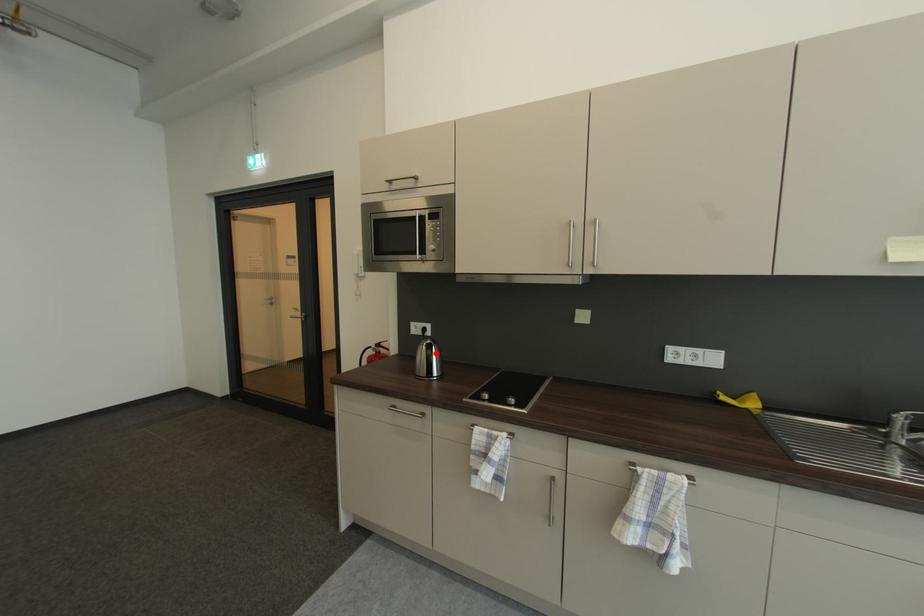
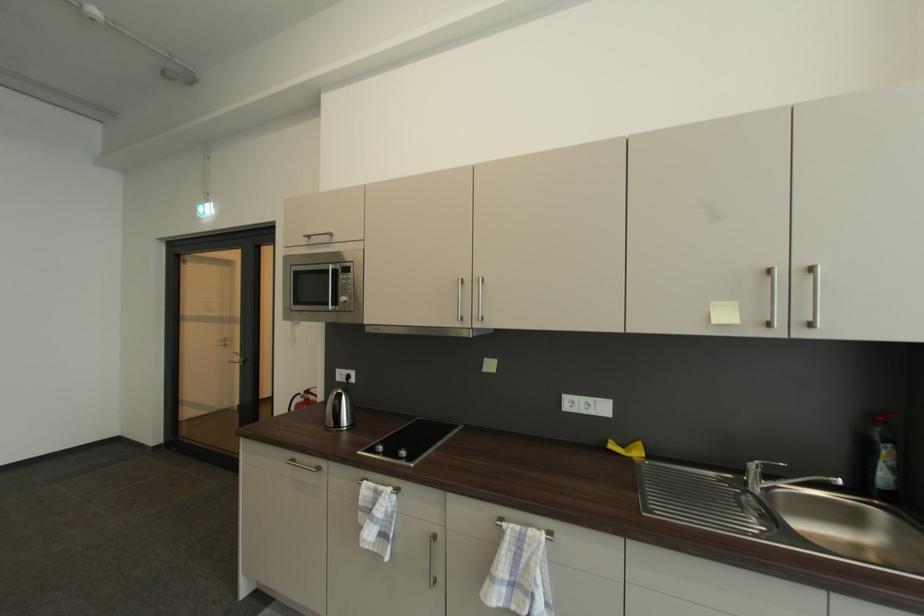
Question: I am providing you with two images of the same scene from different viewpoints. A red point is marked on the first image. Is the red point's position out of view in image 2?

Choices:
 (A) Yes
 (B) No

Answer: (B)